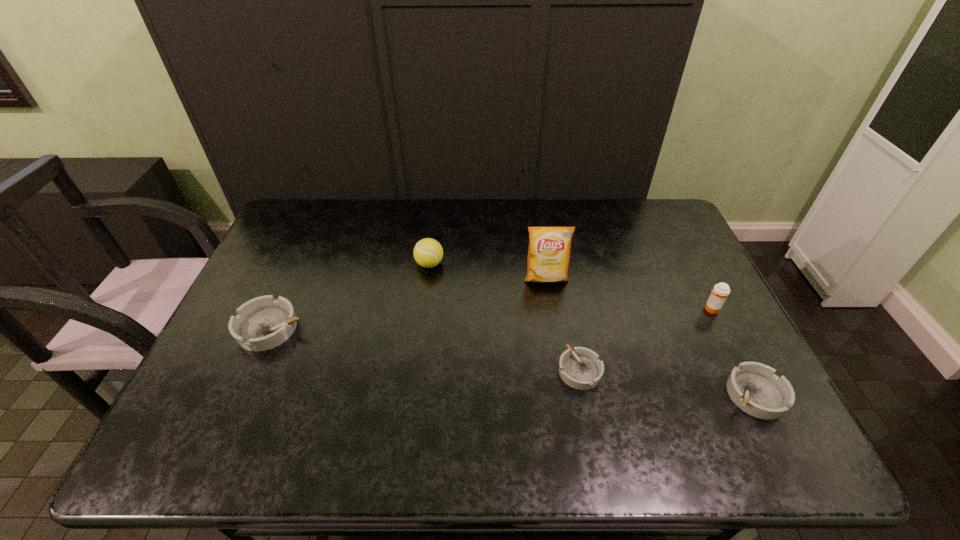
The height and width of the screenshot is (540, 960). Identify the location of vacant position for inserting another ashtray evenly. 419,348.